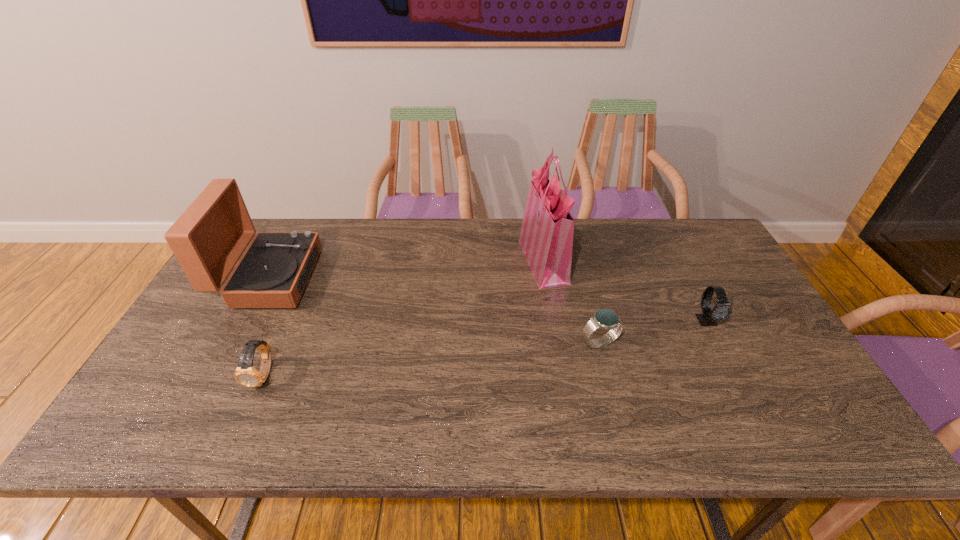
The height and width of the screenshot is (540, 960). Find the location of `vacant space at the left edge`. vacant space at the left edge is located at coordinates (179, 355).

Identify the location of free space at the right edge. This screenshot has width=960, height=540. [x=729, y=265].

Image resolution: width=960 pixels, height=540 pixels. In order to click on vacant area at the far left corner of the desktop in this screenshot , I will do `click(301, 225)`.

This screenshot has height=540, width=960. In the image, there is a desktop. Find the location of `vacant area at the far right corner`. vacant area at the far right corner is located at coordinates (716, 260).

This screenshot has width=960, height=540. What are the coordinates of `vacant space that is in between the leftmost watch and the shopping bag` in the screenshot? It's located at (404, 318).

The image size is (960, 540). Find the location of `free space that is in between the nearest watch and the rightmost object`. free space that is in between the nearest watch and the rightmost object is located at coordinates (486, 348).

Image resolution: width=960 pixels, height=540 pixels. I want to click on vacant area between the fourth farthest object and the phonograph record, so click(435, 310).

Find the location of `free space that is in between the nearest watch and the second nearest watch`. free space that is in between the nearest watch and the second nearest watch is located at coordinates (432, 359).

Find the location of a particular element. vacant area that lies between the tallest object and the leftmost watch is located at coordinates (404, 318).

Where is `free space between the second watch from right to left and the farthest watch`? The height and width of the screenshot is (540, 960). free space between the second watch from right to left and the farthest watch is located at coordinates (654, 332).